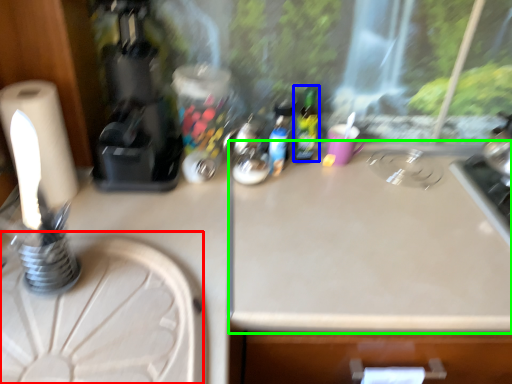
Question: Considering the real-world distances, which object is closest to round table (highlighted by a red box)? bottle (highlighted by a blue box) or counter top (highlighted by a green box).

Choices:
 (A) bottle
 (B) counter top

Answer: (B)